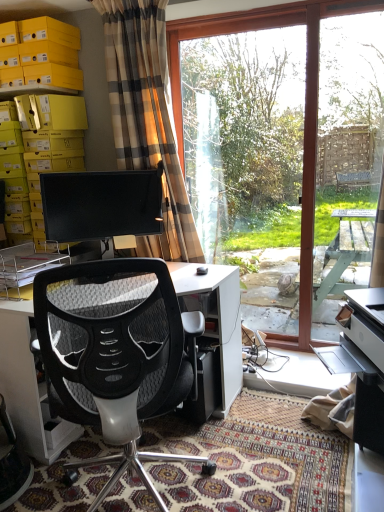
Locate an element on the screen. The image size is (384, 512). free point to the right of black mesh chair at center is located at coordinates (273, 440).